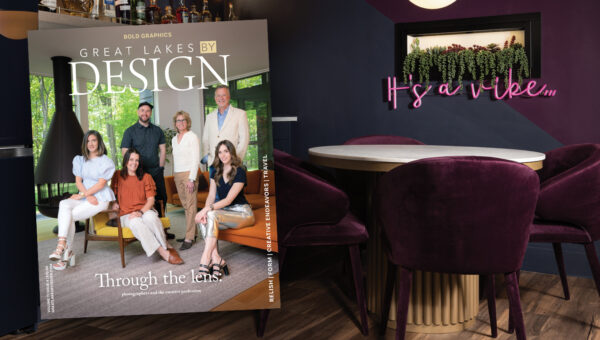
Image resolution: width=600 pixels, height=340 pixels. I want to click on book cover, so click(x=28, y=31), click(x=264, y=21), click(x=279, y=306), click(x=40, y=317).